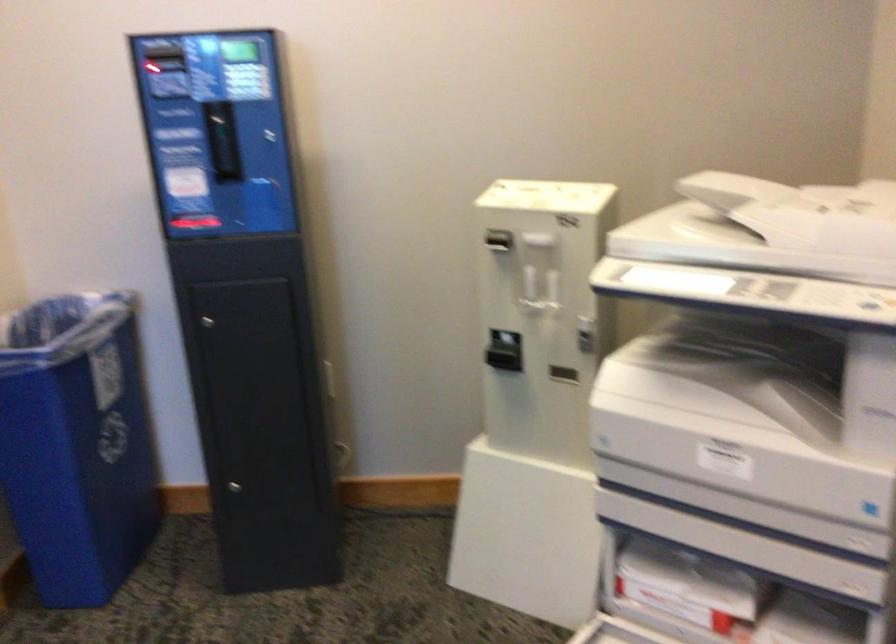
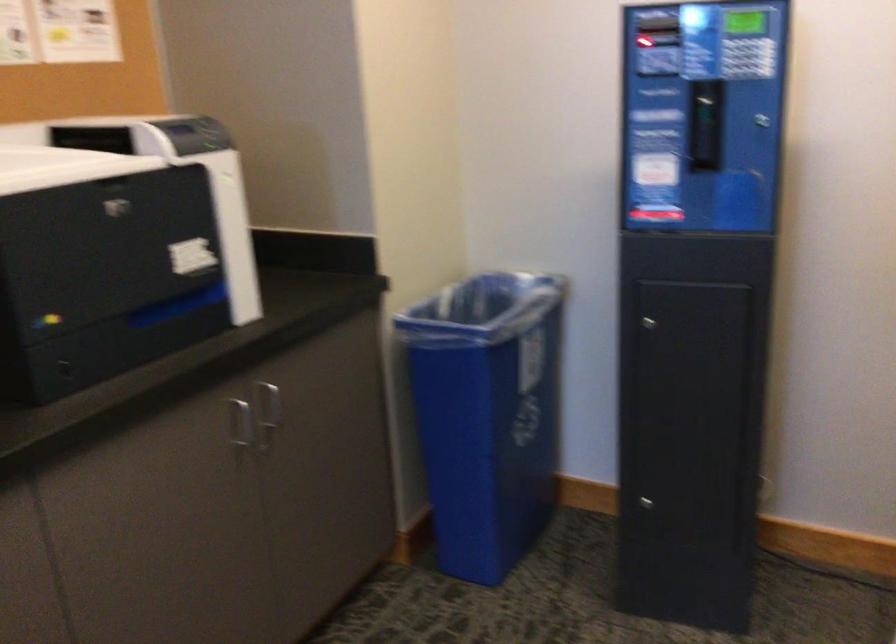
In a continuous first-person perspective shot, in which direction is the camera moving?

The movement direction of the cameraman is left, forward.